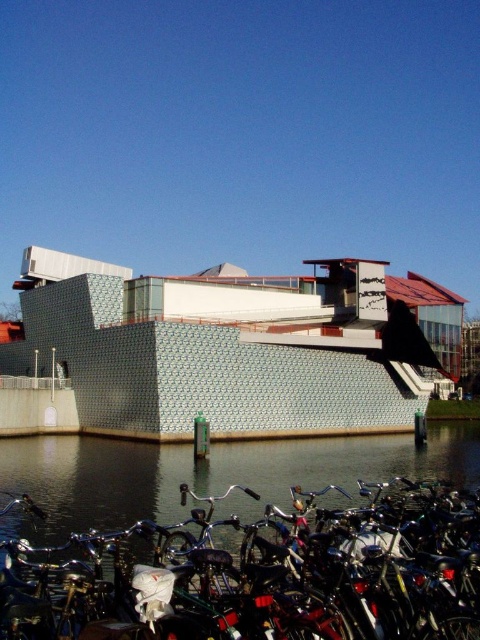
Which is more to the right, shiny metallic bicycle at lower left or dark water at lower left?

Positioned to the right is dark water at lower left.

Is shiny metallic bicycle at lower left closer to camera compared to dark water at lower left?

Yes, it is.

Between point (277, 554) and point (271, 448), which one is positioned in front?

Positioned in front is point (277, 554).

The image size is (480, 640). Find the location of `shiny metallic bicycle at lower left`. shiny metallic bicycle at lower left is located at coordinates (261, 573).